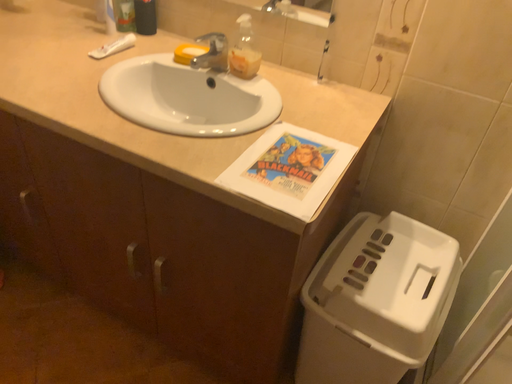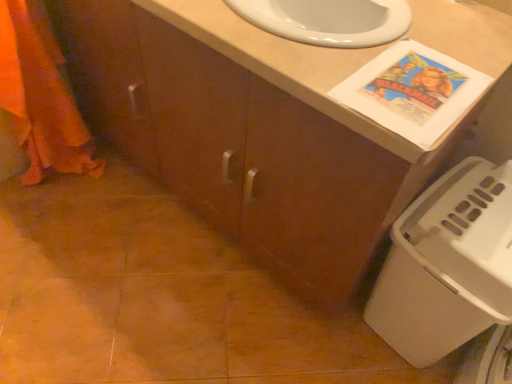
Question: How did the camera likely rotate when shooting the video?

Choices:
 (A) rotated upward
 (B) rotated downward

Answer: (B)